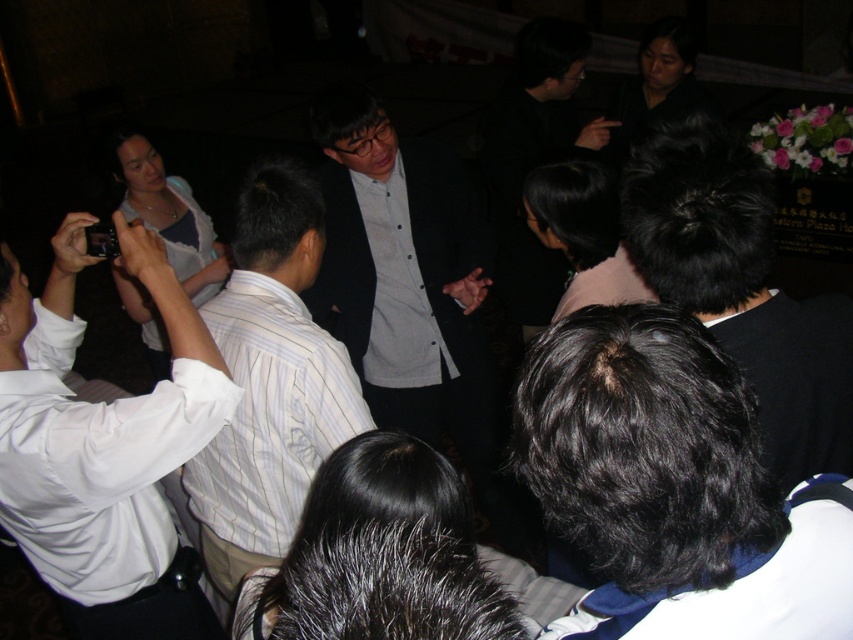
Question: Is black hair at center to the right of gray matte shirt at center from the viewer's perspective?

Choices:
 (A) no
 (B) yes

Answer: (B)

Question: In this image, where is black hair at center located relative to gray matte shirt at center?

Choices:
 (A) below
 (B) above

Answer: (A)

Question: Which of the following is the closest to the observer?

Choices:
 (A) (387, 189)
 (B) (254, 404)
 (C) (820, 369)
 (D) (15, 272)

Answer: (C)

Question: Estimate the real-world distances between objects in this image. Which object is farther from the gray matte shirt at center?

Choices:
 (A) dark gray suit at center
 (B) white shirt at left
 (C) black hair at center
 (D) white striped shirt at center

Answer: (C)

Question: Which point is farther to the camera?

Choices:
 (A) white shirt at left
 (B) black hair at center

Answer: (A)

Question: Where is dark gray suit at center located in relation to white striped shirt at center in the image?

Choices:
 (A) left
 (B) right

Answer: (B)